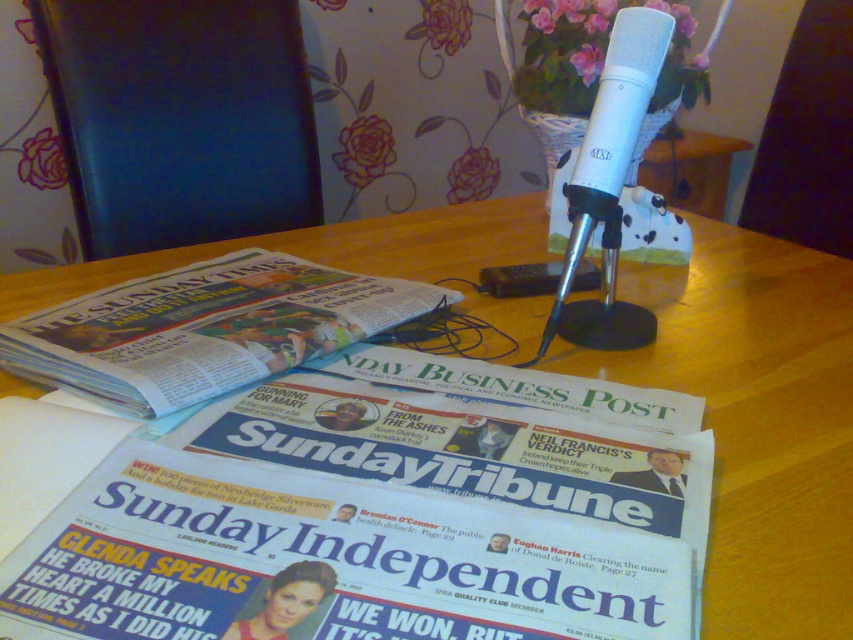
Question: Among these points, which one is nearest to the camera?

Choices:
 (A) (486, 241)
 (B) (91, 397)
 (C) (610, 291)

Answer: (B)

Question: Based on their relative distances, which object is nearer to the white glossy newspaper at center?

Choices:
 (A) wooden table at center
 (B) white matte microphone at center

Answer: (A)

Question: Can you confirm if wooden table at center is positioned to the left of white glossy newspaper at center?

Choices:
 (A) yes
 (B) no

Answer: (B)

Question: Does wooden table at center lie in front of white glossy newspaper at center?

Choices:
 (A) no
 (B) yes

Answer: (B)

Question: Among these points, which one is farthest from the camera?

Choices:
 (A) (490, 316)
 (B) (604, 173)
 (C) (163, 364)

Answer: (A)

Question: Does white glossy newspaper at center appear under white matte microphone at center?

Choices:
 (A) yes
 (B) no

Answer: (A)